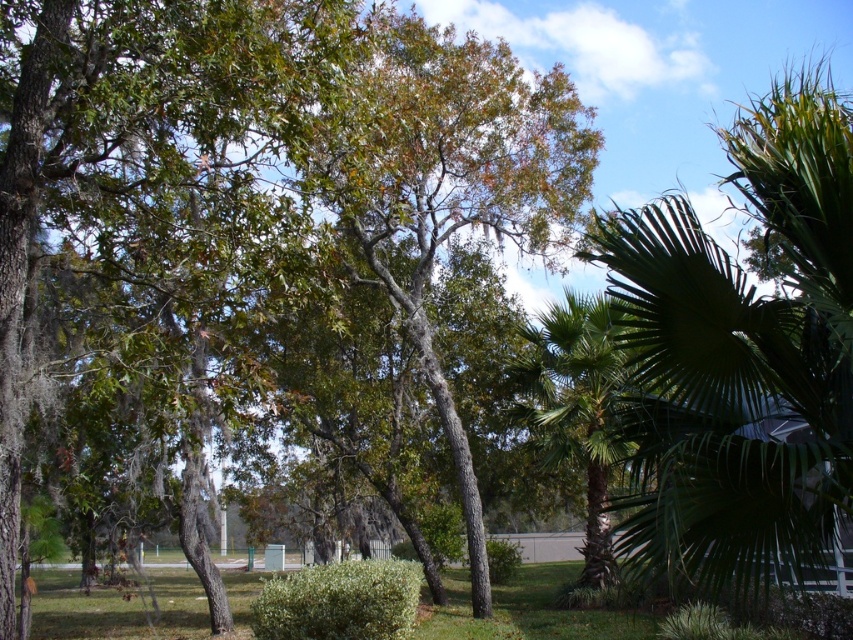
Is green leafy tree at center behind green leafy palm at center?

No, it is not.

Can you confirm if green leafy tree at center is positioned below green leafy palm at center?

No, green leafy tree at center is not below green leafy palm at center.

Between point (282, 125) and point (564, 292), which one is positioned behind?

Positioned behind is point (564, 292).

The image size is (853, 640). What are the coordinates of `green leafy tree at center` in the screenshot? It's located at (291, 228).

Which is in front, point (804, 172) or point (427, 614)?

Point (804, 172)

Between point (721, 138) and point (161, 609), which one is positioned in front?

Point (721, 138)

Locate an element on the screen. The width and height of the screenshot is (853, 640). green leafy palm at right is located at coordinates (740, 355).

Does green leafy tree at center appear over green leafy palm at right?

No, green leafy tree at center is not above green leafy palm at right.

You are a GUI agent. You are given a task and a screenshot of the screen. Output one action in this format:
    pyautogui.click(x=<x>, y=<y>)
    Task: Click on the green leafy tree at center
    The height and width of the screenshot is (640, 853).
    Given the screenshot: What is the action you would take?
    pyautogui.click(x=291, y=228)

Where is `green leafy tree at center`? The width and height of the screenshot is (853, 640). green leafy tree at center is located at coordinates (291, 228).